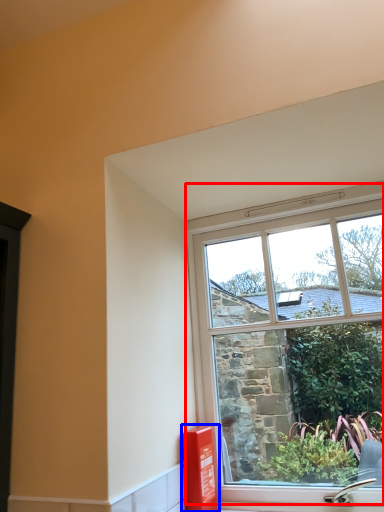
Question: Among these objects, which one is nearest to the camera, window (highlighted by a red box) or window box (highlighted by a blue box)?

Choices:
 (A) window
 (B) window box

Answer: (A)